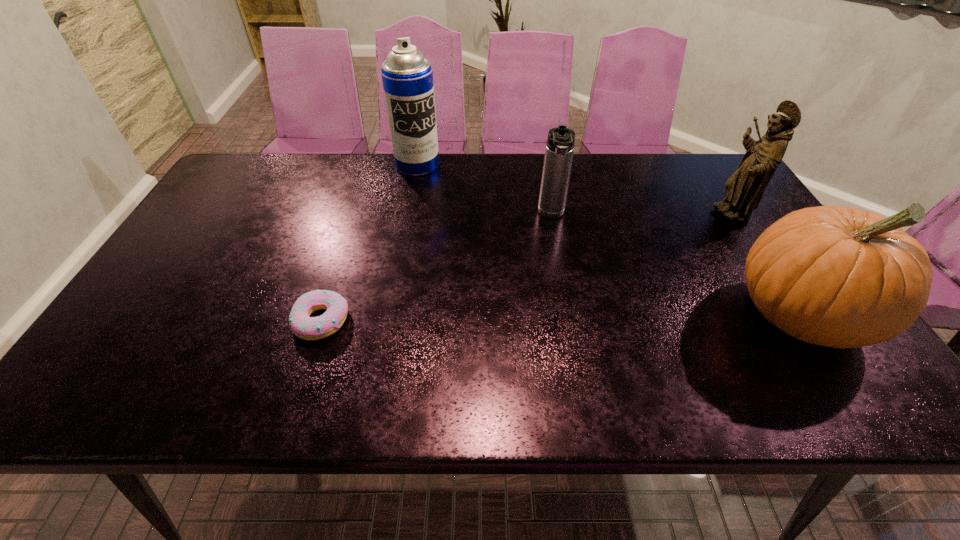
You are a GUI agent. You are given a task and a screenshot of the screen. Output one action in this format:
    pyautogui.click(x=<x>, y=<y>)
    Task: Click on the vacant space on the desktop that is between the doughnut and the pumpkin and is positioned on the handle side of the thermos bottle
    Image resolution: width=960 pixels, height=540 pixels.
    Given the screenshot: What is the action you would take?
    pyautogui.click(x=555, y=318)

You are a GUI agent. You are given a task and a screenshot of the screen. Output one action in this format:
    pyautogui.click(x=<x>, y=<y>)
    Task: Click on the vacant space on the desktop that is between the leftmost object and the pumpkin and is positioned on the front-facing side of the figurine
    
    Given the screenshot: What is the action you would take?
    pyautogui.click(x=556, y=318)

Where is `free space on the desktop that is between the doughnut and the pumpkin and is positioned on the label side of the tallest object`? The height and width of the screenshot is (540, 960). free space on the desktop that is between the doughnut and the pumpkin and is positioned on the label side of the tallest object is located at coordinates (499, 318).